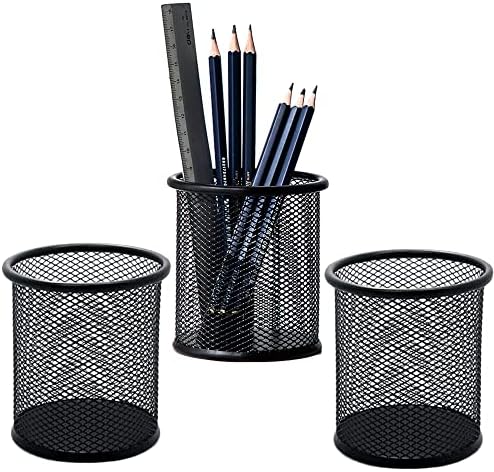
This screenshot has width=494, height=472. In order to click on sharpened pencils points up in this screenshot , I will do `click(216, 101)`, `click(232, 94)`, `click(251, 97)`, `click(277, 127)`, `click(288, 137)`, `click(296, 142)`.